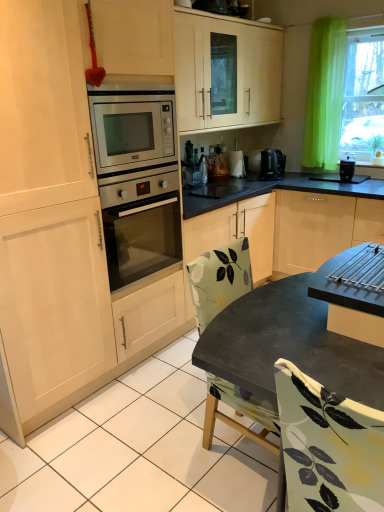
Question: Does metallic silver coffee maker at upper right have a smaller size compared to matte black table at center?

Choices:
 (A) no
 (B) yes

Answer: (B)

Question: Considering the relative sizes of metallic silver coffee maker at upper right and matte black table at center in the image provided, is metallic silver coffee maker at upper right taller than matte black table at center?

Choices:
 (A) yes
 (B) no

Answer: (B)

Question: Is metallic silver coffee maker at upper right in contact with matte black table at center?

Choices:
 (A) yes
 (B) no

Answer: (B)

Question: From the image's perspective, would you say metallic silver coffee maker at upper right is positioned over matte black table at center?

Choices:
 (A) yes
 (B) no

Answer: (A)

Question: Is the depth of metallic silver coffee maker at upper right greater than that of matte black table at center?

Choices:
 (A) yes
 (B) no

Answer: (A)

Question: From a real-world perspective, is satin silver oven at center above or below black plastic coffee maker at right?

Choices:
 (A) below
 (B) above

Answer: (A)

Question: Is satin silver oven at center wider or thinner than black plastic coffee maker at right?

Choices:
 (A) wide
 (B) thin

Answer: (A)

Question: Looking at the image, does satin silver oven at center seem bigger or smaller compared to black plastic coffee maker at right?

Choices:
 (A) small
 (B) big

Answer: (B)

Question: Considering the relative positions of satin silver oven at center and black plastic coffee maker at right in the image provided, is satin silver oven at center to the left or to the right of black plastic coffee maker at right?

Choices:
 (A) left
 (B) right

Answer: (A)

Question: Considering the relative positions of metallic silver coffee maker at upper right and black plastic coffee maker at right in the image provided, is metallic silver coffee maker at upper right to the left or to the right of black plastic coffee maker at right?

Choices:
 (A) left
 (B) right

Answer: (A)

Question: From their relative heights in the image, would you say metallic silver coffee maker at upper right is taller or shorter than black plastic coffee maker at right?

Choices:
 (A) tall
 (B) short

Answer: (A)

Question: Is metallic silver coffee maker at upper right in front of or behind black plastic coffee maker at right in the image?

Choices:
 (A) behind
 (B) front

Answer: (A)

Question: Is point (268, 161) positioned closer to the camera than point (349, 157)?

Choices:
 (A) farther
 (B) closer

Answer: (A)

Question: Does point (349, 158) appear closer or farther from the camera than point (372, 40)?

Choices:
 (A) closer
 (B) farther

Answer: (B)

Question: Based on their sizes in the image, would you say black plastic coffee maker at right is bigger or smaller than green sheer curtain at upper right?

Choices:
 (A) big
 (B) small

Answer: (B)